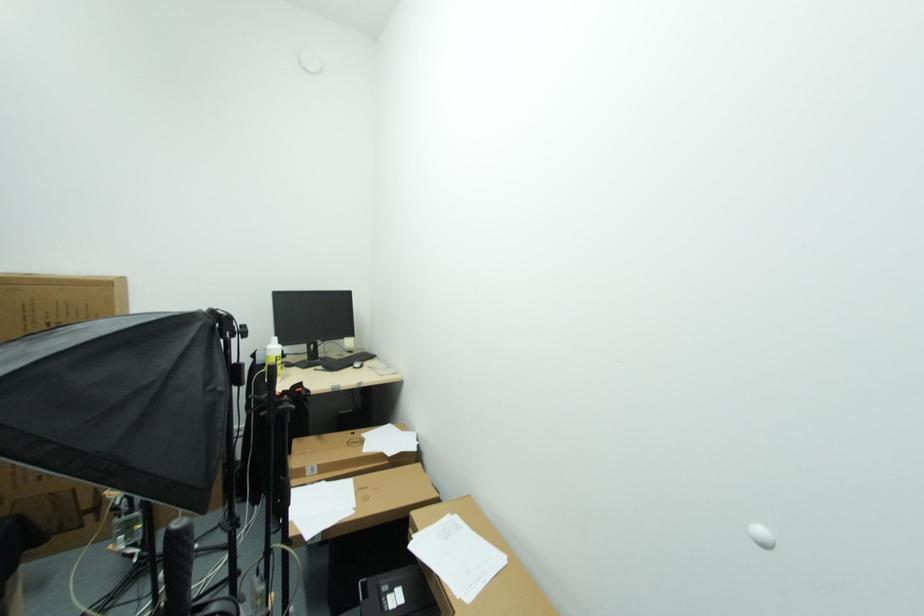
Where is `computer mouse`? Image resolution: width=924 pixels, height=616 pixels. computer mouse is located at coordinates (358, 363).